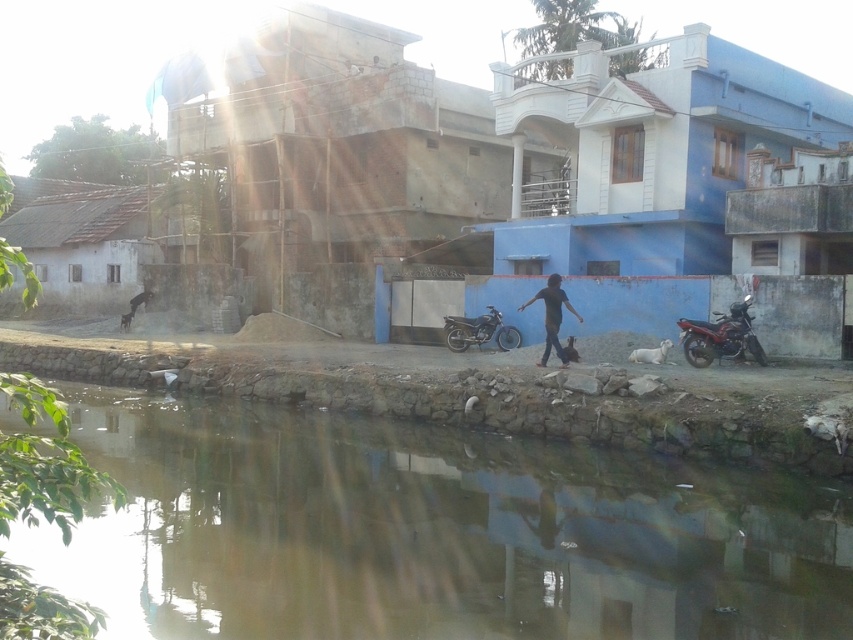
This screenshot has height=640, width=853. I want to click on brown sedimentary river at lower center, so click(431, 532).

Does brown sedimentary river at lower center have a larger size compared to shiny metallic motorcycle at right?

Yes.

What do you see at coordinates (431, 532) in the screenshot? I see `brown sedimentary river at lower center` at bounding box center [431, 532].

I want to click on brown sedimentary river at lower center, so pos(431,532).

Is point (293, 506) closer to viewer compared to point (547, 320)?

Yes, point (293, 506) is in front of point (547, 320).

Can you confirm if brown sedimentary river at lower center is thinner than dark gray shirt at center?

No.

Is point (503, 454) closer to viewer compared to point (553, 305)?

Yes.

Identify the location of brown sedimentary river at lower center. The width and height of the screenshot is (853, 640). [431, 532].

Does brown sedimentary river at lower center have a lesser height compared to shiny metallic motorcycle at center?

Yes, brown sedimentary river at lower center is shorter than shiny metallic motorcycle at center.

Can you confirm if brown sedimentary river at lower center is positioned to the right of shiny metallic motorcycle at center?

No, brown sedimentary river at lower center is not to the right of shiny metallic motorcycle at center.

Image resolution: width=853 pixels, height=640 pixels. Describe the element at coordinates (431, 532) in the screenshot. I see `brown sedimentary river at lower center` at that location.

Where is `brown sedimentary river at lower center`? brown sedimentary river at lower center is located at coordinates (431, 532).